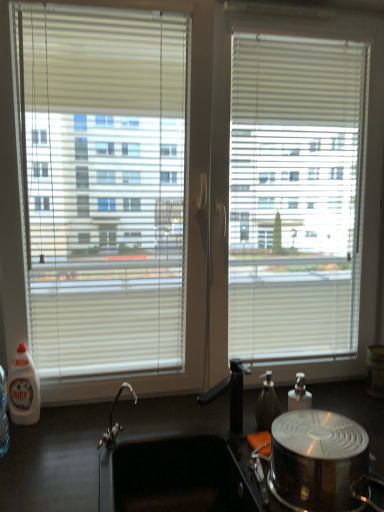
Question: Is black matte countertop at lower center oriented away from white plastic bottle at left, which appears as the second bottle when viewed from the right?

Choices:
 (A) yes
 (B) no

Answer: (B)

Question: Considering the relative positions of black matte countertop at lower center and white plastic bottle at left, placed as the first bottle when sorted from left to right, in the image provided, is black matte countertop at lower center to the right of white plastic bottle at left, placed as the first bottle when sorted from left to right, from the viewer's perspective?

Choices:
 (A) no
 (B) yes

Answer: (B)

Question: Can you confirm if black matte countertop at lower center is smaller than white plastic bottle at left, which appears as the second bottle when viewed from the right?

Choices:
 (A) yes
 (B) no

Answer: (B)

Question: Is black matte countertop at lower center taller than white plastic bottle at left, placed as the first bottle when sorted from left to right?

Choices:
 (A) no
 (B) yes

Answer: (B)

Question: Is there a large distance between black matte countertop at lower center and white plastic bottle at left, which appears as the second bottle when viewed from the right?

Choices:
 (A) no
 (B) yes

Answer: (A)

Question: Considering their positions, is black matte countertop at lower center located in front of or behind shiny metallic pot at lower right?

Choices:
 (A) behind
 (B) front

Answer: (B)

Question: Which is correct: black matte countertop at lower center is inside shiny metallic pot at lower right, or outside of it?

Choices:
 (A) inside
 (B) outside

Answer: (B)

Question: From a real-world perspective, is black matte countertop at lower center physically located above or below shiny metallic pot at lower right?

Choices:
 (A) below
 (B) above

Answer: (A)

Question: Looking at the image, does black matte countertop at lower center seem bigger or smaller compared to shiny metallic pot at lower right?

Choices:
 (A) big
 (B) small

Answer: (A)

Question: Looking at their shapes, would you say shiny metallic pot at lower right is wider or thinner than white plastic bottle at left, which appears as the second bottle when viewed from the right?

Choices:
 (A) wide
 (B) thin

Answer: (A)

Question: Is point (354, 500) closer or farther from the camera than point (16, 357)?

Choices:
 (A) closer
 (B) farther

Answer: (A)

Question: From a real-world perspective, is shiny metallic pot at lower right above or below white plastic bottle at left, which appears as the second bottle when viewed from the right?

Choices:
 (A) above
 (B) below

Answer: (B)

Question: Is shiny metallic pot at lower right bigger or smaller than white plastic bottle at left, placed as the first bottle when sorted from left to right?

Choices:
 (A) big
 (B) small

Answer: (A)

Question: Is black matte countertop at lower center inside the boundaries of white plastic bottle at left, placed as the first bottle when sorted from left to right, or outside?

Choices:
 (A) inside
 (B) outside

Answer: (B)

Question: Considering the positions of black matte countertop at lower center and white plastic bottle at left, placed as the first bottle when sorted from left to right, in the image, is black matte countertop at lower center bigger or smaller than white plastic bottle at left, placed as the first bottle when sorted from left to right,?

Choices:
 (A) small
 (B) big

Answer: (B)